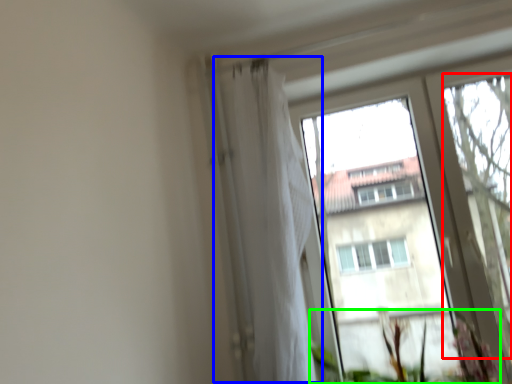
Question: Based on their relative distances, which object is farther from tree (highlighted by a red box)? Choose from shower curtain (highlighted by a blue box) and vegetation (highlighted by a green box).

Choices:
 (A) shower curtain
 (B) vegetation

Answer: (A)